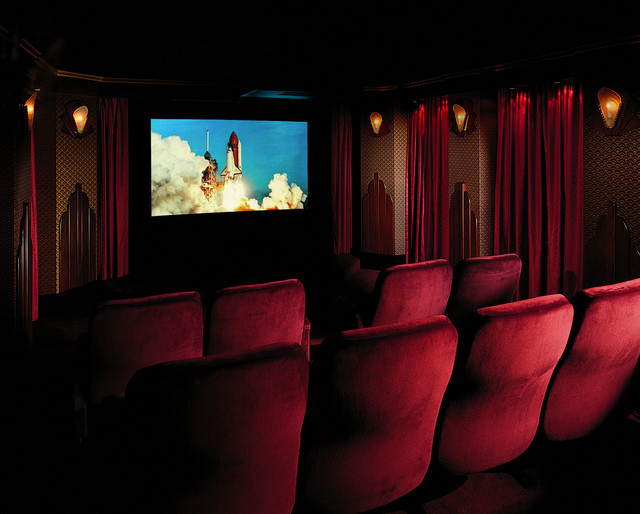
Where is `sconce`? sconce is located at coordinates (381, 126), (457, 119), (619, 115), (83, 121), (34, 115).